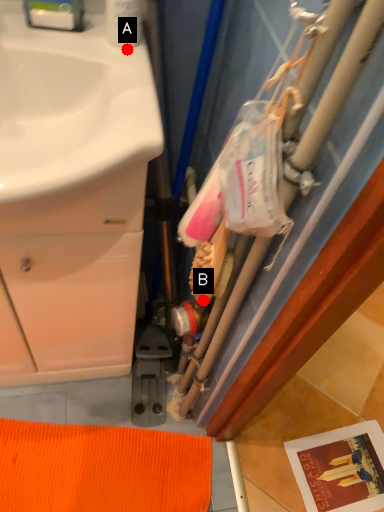
Question: Two points are circled on the image, labeled by A and B beside each circle. Which point is further to the camera?

Choices:
 (A) A is further
 (B) B is further

Answer: (B)